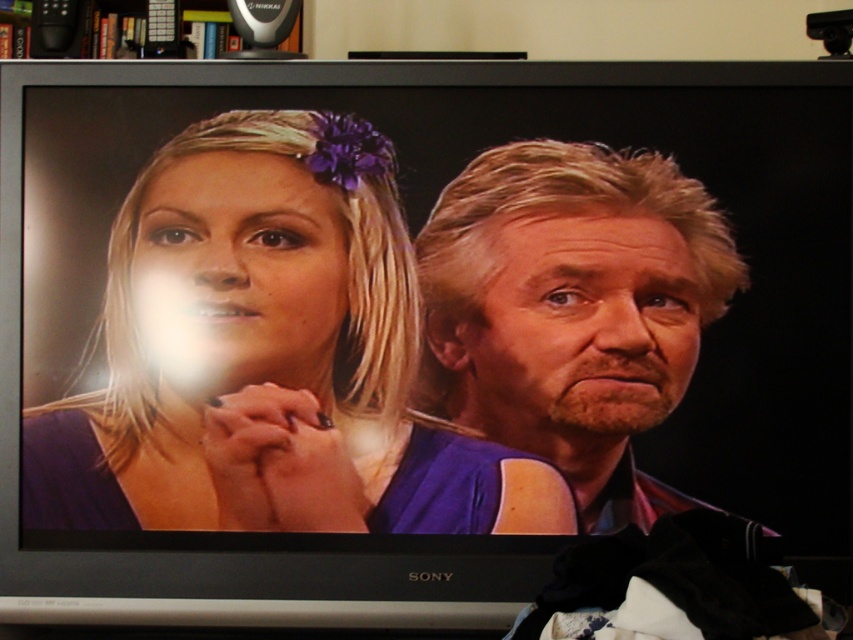
Does point (477, 461) come in front of point (611, 273)?

Yes, it is in front of point (611, 273).

Between purple matte hair clip at center and blonde hair at right, which one appears on the right side from the viewer's perspective?

blonde hair at right is more to the right.

Does point (74, 420) come behind point (660, 513)?

Yes.

You are a GUI agent. You are given a task and a screenshot of the screen. Output one action in this format:
    pyautogui.click(x=<x>, y=<y>)
    Task: Click on the purple matte hair clip at center
    
    Given the screenshot: What is the action you would take?
    pyautogui.click(x=270, y=356)

Does blonde hair at right appear on the right side of wooden bookshelf at upper center?

Indeed, blonde hair at right is positioned on the right side of wooden bookshelf at upper center.

Which is behind, point (543, 372) or point (108, 1)?

Point (108, 1)

The image size is (853, 640). Find the location of `blonde hair at right`. blonde hair at right is located at coordinates coord(572,308).

Does purple matte hair clip at center have a lesser width compared to wooden bookshelf at upper center?

Incorrect, purple matte hair clip at center's width is not less than wooden bookshelf at upper center's.

Does purple matte hair clip at center lie behind wooden bookshelf at upper center?

No, purple matte hair clip at center is in front of wooden bookshelf at upper center.

Identify the location of purple matte hair clip at center. This screenshot has width=853, height=640. (270, 356).